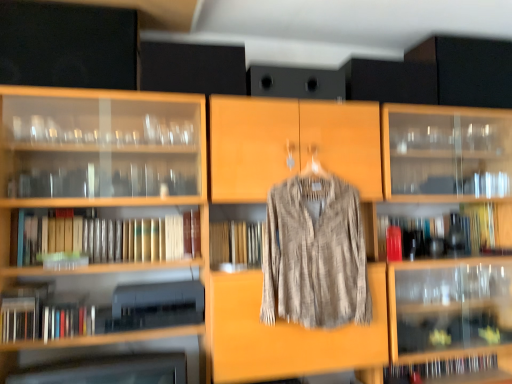
Question: From the image's perspective, is yellow paperback book at right, the fourth book in the left-to-right sequence, positioned above or below textured beige shirt at center?

Choices:
 (A) below
 (B) above

Answer: (A)

Question: Relative to textured beige shirt at center, is yellow paperback book at right, which is counted as the 4th book, starting from the bottom, in front or behind?

Choices:
 (A) behind
 (B) front

Answer: (A)

Question: Which is farther from the yellow paperback book at right, the 1th book when ordered from top to bottom?

Choices:
 (A) white paper book at center, which is the 3th book in bottom-to-top order
 (B) wooden book at center, the second book from the left
 (C) wooden bookshelf at lower left
 (D) textured beige shirt at center
 (E) hardcover book at lower right, which is the 1th book in bottom-to-top order

Answer: (C)

Question: Which object is positioned farthest from the textured beige shirt at center?

Choices:
 (A) yellow paperback book at right, the 1th book when ordered from top to bottom
 (B) wooden book at center, the second book from the left
 (C) hardcover book at lower right, which ranks as the 3th book in left-to-right order
 (D) white paper book at center, arranged as the 4th book when viewed from the right
 (E) wooden bookshelf at lower left

Answer: (A)